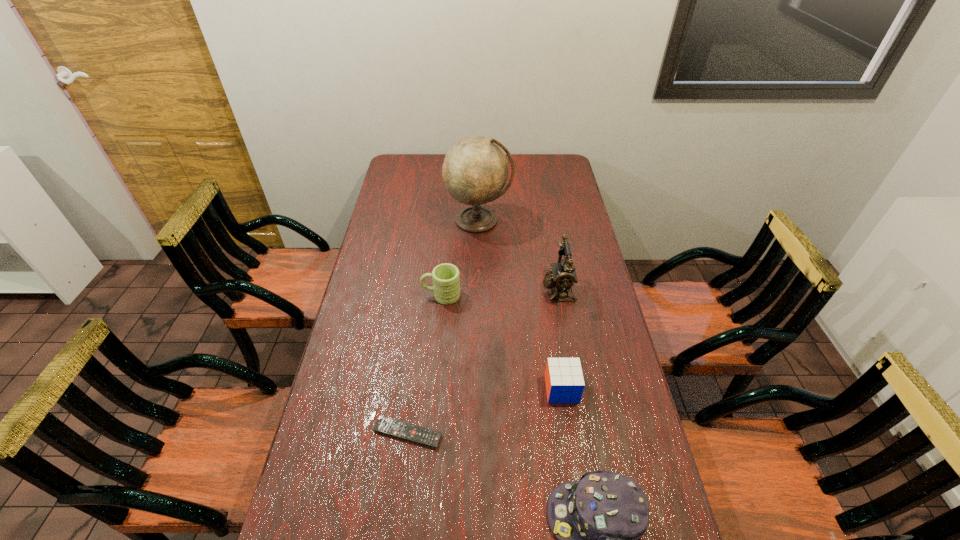
Where is `the farthest object`? The height and width of the screenshot is (540, 960). the farthest object is located at coordinates (475, 170).

The image size is (960, 540). I want to click on the tallest object, so click(475, 170).

Where is `telephone`? Image resolution: width=960 pixels, height=540 pixels. telephone is located at coordinates (563, 275).

I want to click on mug, so click(x=446, y=283).

At what (x,y) coordinates should I click in order to perform the action: click on cube. Please return your answer as a coordinate pair (x, y). This screenshot has width=960, height=540. Looking at the image, I should click on [564, 380].

At what (x,y) coordinates should I click in order to perform the action: click on the third nearest object. Please return your answer as a coordinate pair (x, y). The width and height of the screenshot is (960, 540). Looking at the image, I should click on (564, 380).

This screenshot has width=960, height=540. Find the location of `the shortest object`. the shortest object is located at coordinates (384, 425).

Locate an element on the screen. the fifth farthest object is located at coordinates (384, 425).

Where is `vacant area situated 0.400m on the front-facing side of the tallest object`? vacant area situated 0.400m on the front-facing side of the tallest object is located at coordinates 478,314.

Image resolution: width=960 pixels, height=540 pixels. In order to click on free space located on the rotary dial of the fifth shortest object in this screenshot , I will do `click(453, 289)`.